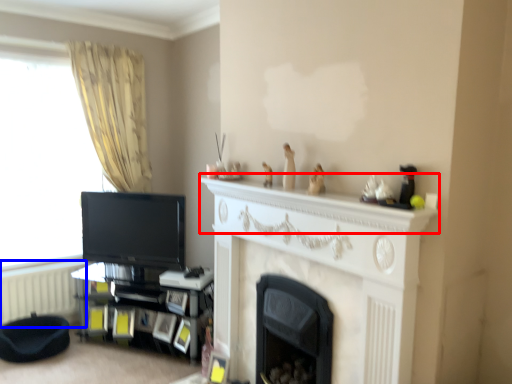
Question: Among these objects, which one is nearest to the camera, mantle (highlighted by a red box) or radiator (highlighted by a blue box)?

Choices:
 (A) mantle
 (B) radiator

Answer: (A)